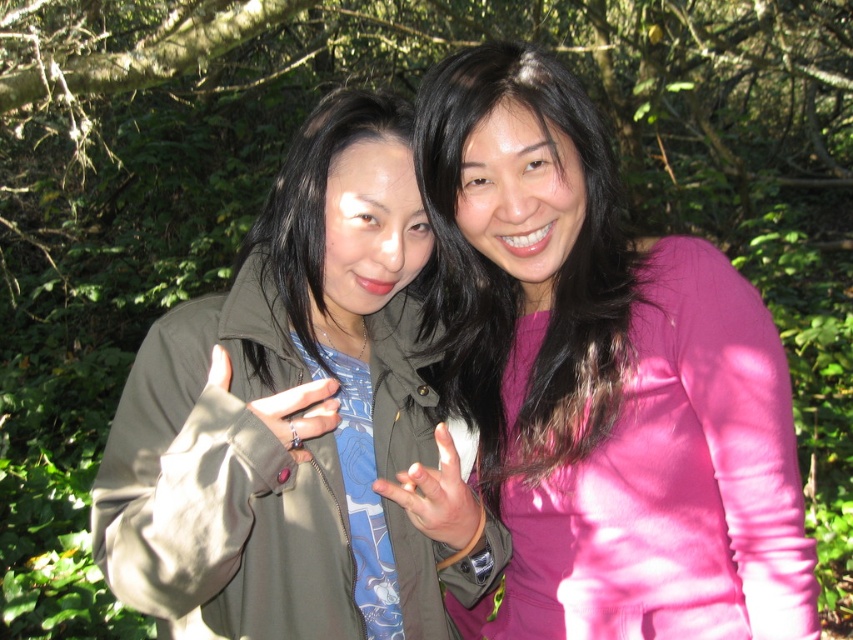
Question: Estimate the real-world distances between objects in this image. Which object is farther from the matte green jacket at center?

Choices:
 (A) pink matte shirt at center
 (B) pink satin blouse at center

Answer: (B)

Question: Is pink satin blouse at center above matte olive green jacket at center?

Choices:
 (A) yes
 (B) no

Answer: (A)

Question: Considering the real-world distances, which object is closest to the pink matte shirt at center?

Choices:
 (A) matte black ring at center
 (B) matte green jacket at center
 (C) pink satin blouse at center
 (D) matte olive green jacket at center

Answer: (C)

Question: Observing the image, what is the correct spatial positioning of pink matte shirt at center in reference to matte green jacket at center?

Choices:
 (A) left
 (B) right

Answer: (B)

Question: Among these objects, which one is nearest to the camera?

Choices:
 (A) matte green jacket at center
 (B) matte black ring at center
 (C) pink satin blouse at center

Answer: (B)

Question: Considering the relative positions of pink satin blouse at center and pink matte shirt at center in the image provided, where is pink satin blouse at center located with respect to pink matte shirt at center?

Choices:
 (A) left
 (B) right

Answer: (B)